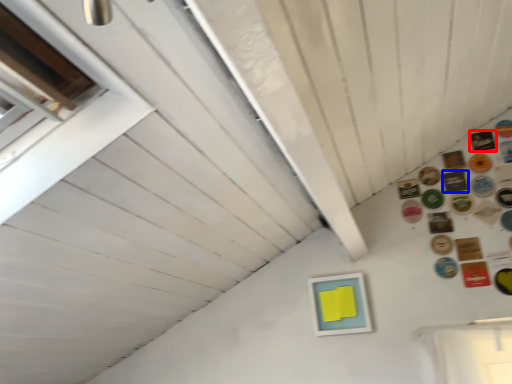
Question: Which object appears farthest to the camera in this image, button (highlighted by a red box) or button (highlighted by a blue box)?

Choices:
 (A) button
 (B) button

Answer: (A)